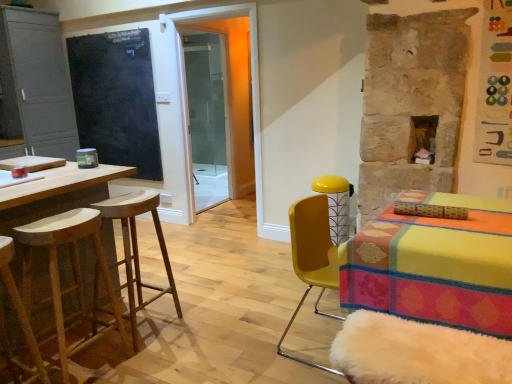
Where is `matte gray cabinet at left`? This screenshot has height=384, width=512. matte gray cabinet at left is located at coordinates (36, 83).

The height and width of the screenshot is (384, 512). What do you see at coordinates (73, 276) in the screenshot? I see `natural wood stool at left, the second stool from the back` at bounding box center [73, 276].

This screenshot has width=512, height=384. What do you see at coordinates (208, 117) in the screenshot?
I see `transparent glass shower door at center` at bounding box center [208, 117].

Find the location of a particular element. The height and width of the screenshot is (384, 512). wooden stool at left, which is counted as the third stool, starting from the back is located at coordinates (19, 322).

At what (x,y) coordinates should I click in order to perform the action: click on black chalkboard at left. Please return your answer as a coordinate pair (x, y). The width and height of the screenshot is (512, 384). Looking at the image, I should click on (116, 99).

The image size is (512, 384). What do you see at coordinates (313, 257) in the screenshot?
I see `yellow matte chair at right` at bounding box center [313, 257].

The height and width of the screenshot is (384, 512). I want to click on matte gray cabinet at left, so click(x=36, y=83).

Based on the photo, is black chalkboard at left aimed at wooden stool at left, which is the first stool from front to back?

No, black chalkboard at left is not turned towards wooden stool at left, which is the first stool from front to back.

From the picture: Between black chalkboard at left and wooden stool at left, which is the first stool from front to back, which one has larger width?

With larger width is wooden stool at left, which is the first stool from front to back.

Based on the photo, from the image's perspective, which one is positioned higher, black chalkboard at left or wooden stool at left, which is counted as the third stool, starting from the back?

From the image's view, black chalkboard at left is above.

Does wooden stool at left, which is the first stool from front to back, touch black chalkboard at left?

No, wooden stool at left, which is the first stool from front to back, is not touching black chalkboard at left.

Considering the positions of objects wooden stool at left, which is counted as the third stool, starting from the back, and black chalkboard at left in the image provided, who is more to the left, wooden stool at left, which is counted as the third stool, starting from the back, or black chalkboard at left?

black chalkboard at left is more to the left.

Between wooden stool at left, which is the first stool from front to back, and black chalkboard at left, which one is positioned in front?

wooden stool at left, which is the first stool from front to back, is in front.

Does point (9, 366) appear closer or farther from the camera than point (113, 140)?

Point (9, 366).

Is natural wood stool at left, the second stool from the back, positioned far away from yellow matte chair at right?

Yes, natural wood stool at left, the second stool from the back, is far from yellow matte chair at right.

Find the location of a particular element. This screenshot has height=384, width=512. chair located behind the natural wood stool at left, the second stool viewed from the front is located at coordinates (313, 257).

Who is more distant, natural wood stool at left, the second stool from the back, or yellow matte chair at right?

Positioned behind is yellow matte chair at right.

Is transparent glass shower door at center aimed at matte gray cabinet at left?

No, transparent glass shower door at center is not oriented towards matte gray cabinet at left.

From a real-world perspective, is transparent glass shower door at center positioned above or below matte gray cabinet at left?

Answer: From a real-world perspective, transparent glass shower door at center is physically below matte gray cabinet at left.

Locate an element on the screen. The width and height of the screenshot is (512, 384). screen door below the matte gray cabinet at left (from a real-world perspective) is located at coordinates click(208, 117).

Who is shorter, transparent glass shower door at center or matte gray cabinet at left?

With less height is matte gray cabinet at left.

Which is more to the left, wooden bar stool at left, placed as the 3th stool when sorted from front to back, or transparent glass shower door at center?

wooden bar stool at left, placed as the 3th stool when sorted from front to back.

Where is `screen door on the right of wooden bar stool at left, arranged as the 1th stool when viewed from the back`? screen door on the right of wooden bar stool at left, arranged as the 1th stool when viewed from the back is located at coordinates (208, 117).

From the image's perspective, is wooden bar stool at left, arranged as the 1th stool when viewed from the back, above transparent glass shower door at center?

No.

From the image's perspective, is black chalkboard at left above transparent glass shower door at center?

Yes, from the image's perspective, black chalkboard at left is above transparent glass shower door at center.

The height and width of the screenshot is (384, 512). Identify the location of bulletin board in front of the transparent glass shower door at center. (116, 99).

Can you tell me how much black chalkboard at left and transparent glass shower door at center differ in facing direction?

The angle between the facing direction of black chalkboard at left and the facing direction of transparent glass shower door at center is 89.3 degrees.

Is wooden bar stool at left, placed as the 3th stool when sorted from front to back, shorter than black chalkboard at left?

Correct, wooden bar stool at left, placed as the 3th stool when sorted from front to back, is not as tall as black chalkboard at left.

Are wooden bar stool at left, placed as the 3th stool when sorted from front to back, and black chalkboard at left located far from each other?

Yes, wooden bar stool at left, placed as the 3th stool when sorted from front to back, and black chalkboard at left are located far from each other.

What's the angular difference between wooden bar stool at left, arranged as the 1th stool when viewed from the back, and black chalkboard at left's facing directions?

The angle between the facing direction of wooden bar stool at left, arranged as the 1th stool when viewed from the back, and the facing direction of black chalkboard at left is 89.4 degrees.

Is wooden bar stool at left, placed as the 3th stool when sorted from front to back, aimed at black chalkboard at left?

No, wooden bar stool at left, placed as the 3th stool when sorted from front to back, is not facing towards black chalkboard at left.

At what (x,y) coordinates should I click in order to perform the action: click on the 3rd stool in front when counting from the black chalkboard at left. Please return your answer as a coordinate pair (x, y). Looking at the image, I should click on 19,322.

Find the location of a particular element. bulletin board above the wooden stool at left, which is the first stool from front to back (from a real-world perspective) is located at coordinates pyautogui.click(x=116, y=99).

Looking at the image, which one is located further to transparent glass shower door at center, black chalkboard at left or natural wood stool at left, the second stool viewed from the front?

Among the two, natural wood stool at left, the second stool viewed from the front, is located further to transparent glass shower door at center.

Based on their spatial positions, is natural wood stool at left, the second stool viewed from the front, or matte gray cabinet at left further from wooden bar stool at left, placed as the 3th stool when sorted from front to back?

matte gray cabinet at left is further to wooden bar stool at left, placed as the 3th stool when sorted from front to back.

From the image, which object appears to be nearer to transparent glass shower door at center, black chalkboard at left or wooden bar stool at left, arranged as the 1th stool when viewed from the back?

Among the two, black chalkboard at left is located nearer to transparent glass shower door at center.

From the picture: Looking at the image, which one is located closer to yellow matte chair at right, wooden bar stool at left, arranged as the 1th stool when viewed from the back, or transparent glass shower door at center?

Based on the image, wooden bar stool at left, arranged as the 1th stool when viewed from the back, appears to be nearer to yellow matte chair at right.

From the image, which object appears to be farther from wooden bar stool at left, placed as the 3th stool when sorted from front to back, matte gray cabinet at left or transparent glass shower door at center?

transparent glass shower door at center.

Consider the image. When comparing their distances from wooden bar stool at left, placed as the 3th stool when sorted from front to back, does wooden stool at left, which is the first stool from front to back, or natural wood stool at left, the second stool from the back, seem closer?

natural wood stool at left, the second stool from the back.

Based on their spatial positions, is wooden bar stool at left, arranged as the 1th stool when viewed from the back, or black chalkboard at left closer to natural wood stool at left, the second stool from the back?

The object closer to natural wood stool at left, the second stool from the back, is wooden bar stool at left, arranged as the 1th stool when viewed from the back.

Looking at the image, which one is located closer to wooden bar stool at left, arranged as the 1th stool when viewed from the back, yellow matte chair at right or wooden stool at left, which is counted as the third stool, starting from the back?

wooden stool at left, which is counted as the third stool, starting from the back.

Identify the location of bulletin board located between wooden bar stool at left, placed as the 3th stool when sorted from front to back, and transparent glass shower door at center in the depth direction. Image resolution: width=512 pixels, height=384 pixels. (116, 99).

The image size is (512, 384). Identify the location of chair between wooden stool at left, which is counted as the third stool, starting from the back, and transparent glass shower door at center in the front-back direction. (313, 257).

Find the location of a particular element. This screenshot has width=512, height=384. chair between wooden stool at left, which is counted as the third stool, starting from the back, and black chalkboard at left in the front-back direction is located at coordinates (313, 257).

Identify the location of cabinetry between wooden bar stool at left, placed as the 3th stool when sorted from front to back, and transparent glass shower door at center, along the z-axis. The width and height of the screenshot is (512, 384). (36, 83).